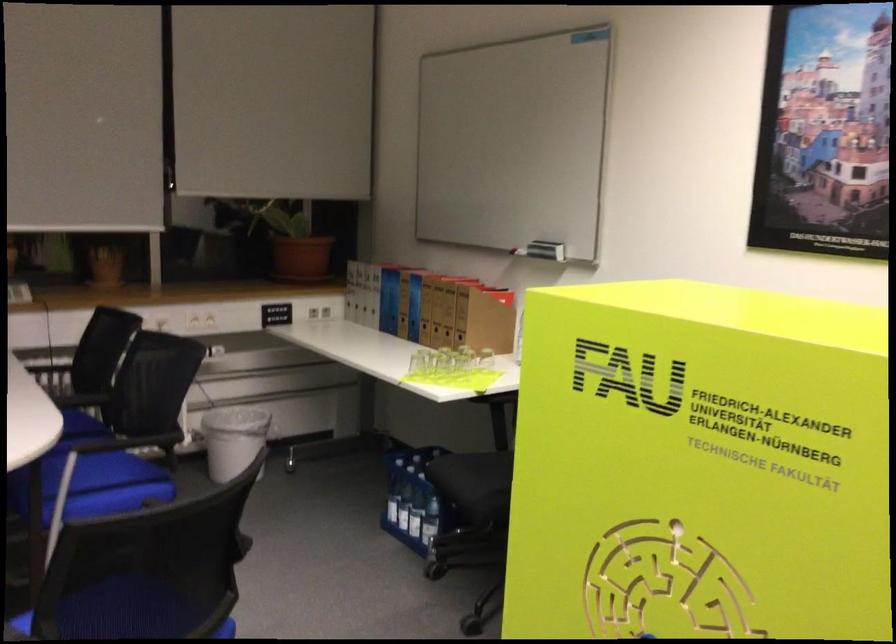
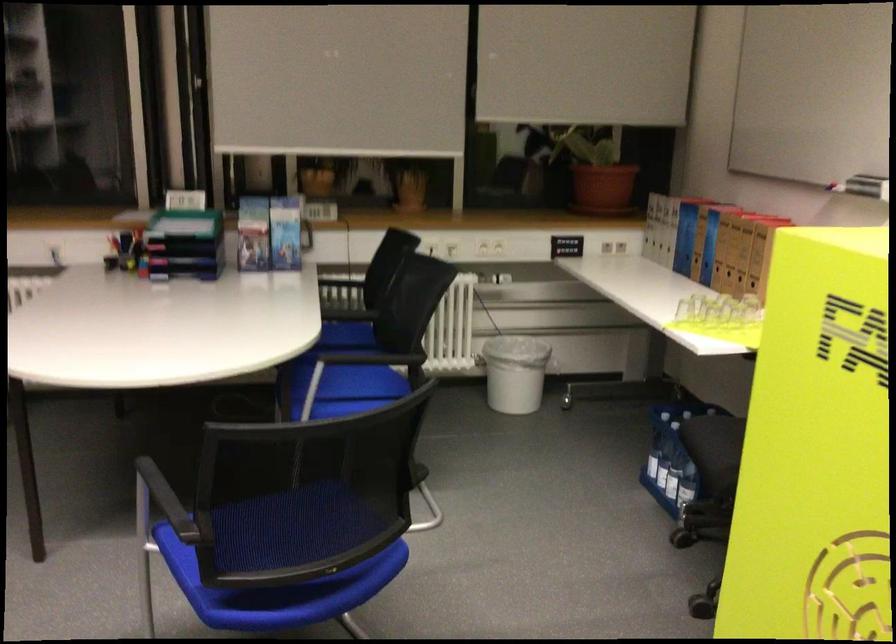
In a continuous first-person perspective shot, in which direction is the camera moving?

The movement direction of the cameraman is right, forward.